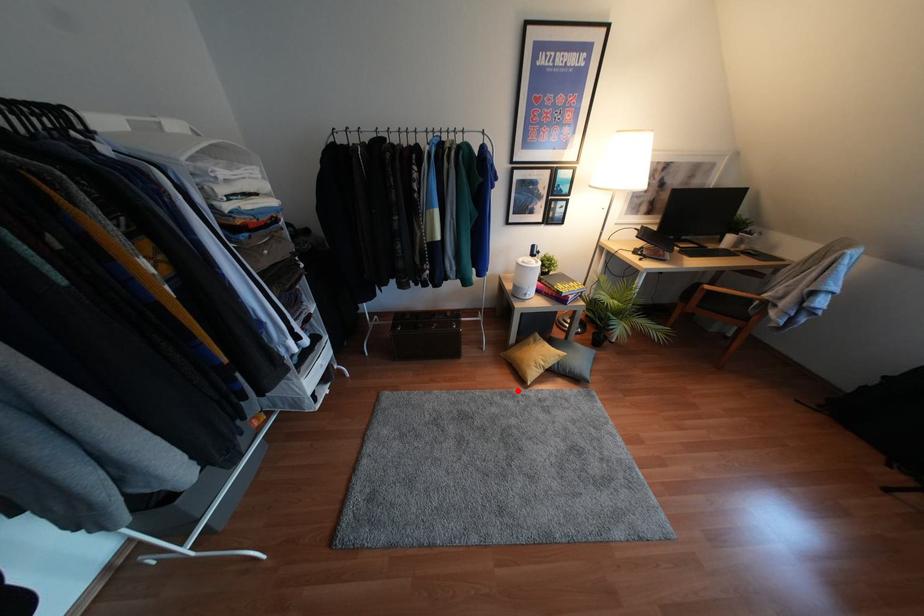
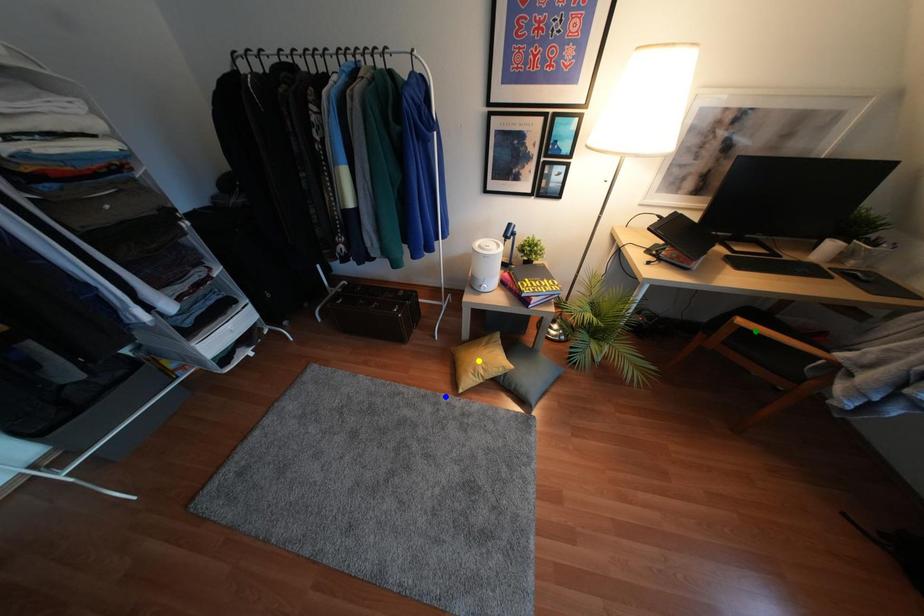
Question: I am providing you with two images of the same scene from different viewpoints. A red point is marked on the first image. You are given multiple points on the second image. Which point in image 2 represents the same 3d spot as the red point in image 1?

Choices:
 (A) green point
 (B) blue point
 (C) yellow point

Answer: (B)